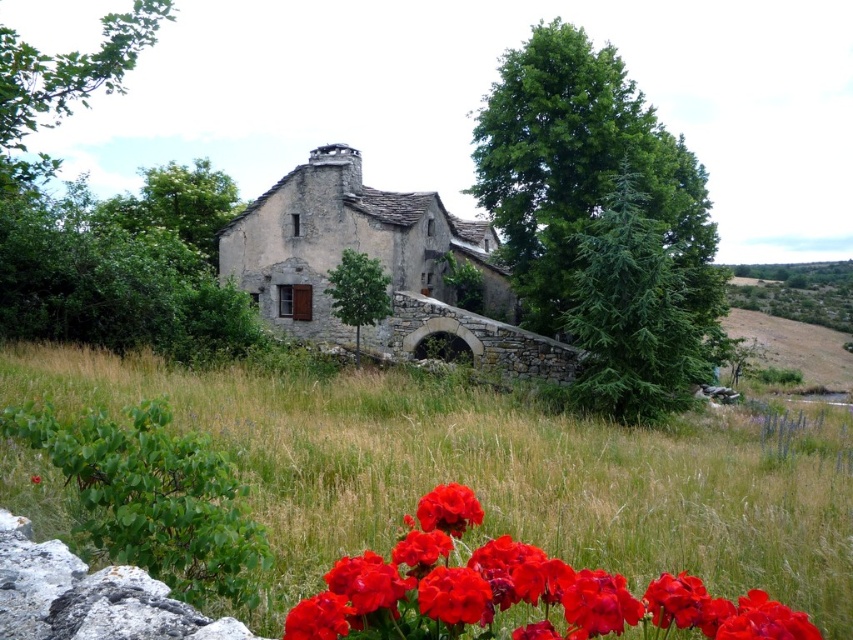
Is point (378, 518) positioned behind point (759, 624)?

Yes.

Can you confirm if green grass at center is wider than glossy red flowers at lower center?

Yes, green grass at center is wider than glossy red flowers at lower center.

Is point (566, 547) behind point (321, 636)?

Yes, point (566, 547) is farther from viewer.

Where is `green grass at center`? This screenshot has width=853, height=640. green grass at center is located at coordinates (492, 474).

Where is `glossy red flowers at lower center`? glossy red flowers at lower center is located at coordinates (517, 596).

Who is more distant from viewer, [357,563] or [419,506]?

Positioned behind is point [419,506].

At what (x,y) coordinates should I click in order to perform the action: click on glossy red flowers at lower center. Please return your answer as a coordinate pair (x, y). This screenshot has width=853, height=640. Looking at the image, I should click on (517, 596).

Can you confirm if green grass at center is taller than matte red flower at lower center?

Correct, green grass at center is much taller as matte red flower at lower center.

Is point (1, 442) positioned after point (450, 513)?

Yes, it is.

You are a GUI agent. You are given a task and a screenshot of the screen. Output one action in this format:
    pyautogui.click(x=<x>, y=<y>)
    Task: Click on the green grass at center
    
    Given the screenshot: What is the action you would take?
    pyautogui.click(x=492, y=474)